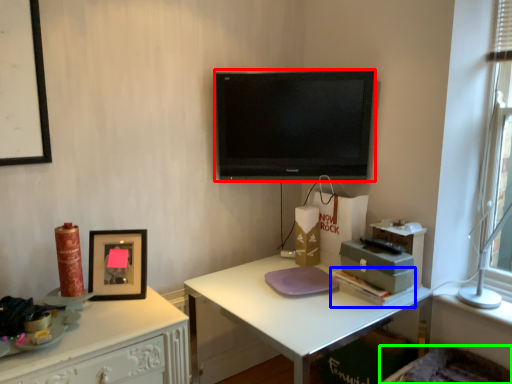
Question: Which object is positioned farthest from television (highlighted by a red box)? Select from book (highlighted by a blue box) and swivel chair (highlighted by a green box).

Choices:
 (A) book
 (B) swivel chair

Answer: (B)